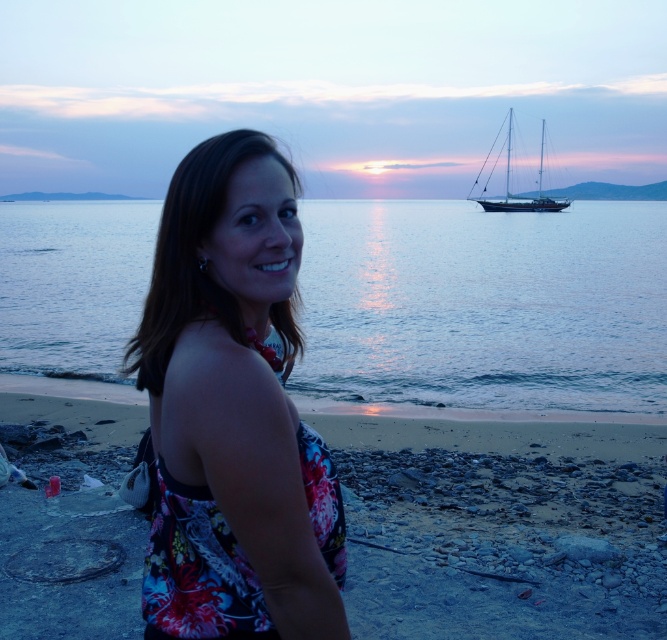
Question: Is smooth sand at lower center smaller than floral fabric dress at center?

Choices:
 (A) no
 (B) yes

Answer: (A)

Question: Is blue water at center above floral fabric dress at center?

Choices:
 (A) no
 (B) yes

Answer: (B)

Question: Which point appears closest to the camera in this image?

Choices:
 (A) (464, 212)
 (B) (506, 189)
 (C) (636, 476)
 (D) (283, 506)

Answer: (D)

Question: Which object is the farthest from the blue water at center?

Choices:
 (A) floral fabric dress at center
 (B) dark blue polished wood sailboat at upper right
 (C) smooth sand at lower center

Answer: (A)

Question: Which point is farther to the camera?

Choices:
 (A) coord(450,282)
 (B) coord(109,481)
 (C) coord(536,202)
 (D) coord(177,531)

Answer: (C)

Question: Is smooth sand at lower center below floral fabric dress at center?

Choices:
 (A) yes
 (B) no

Answer: (A)